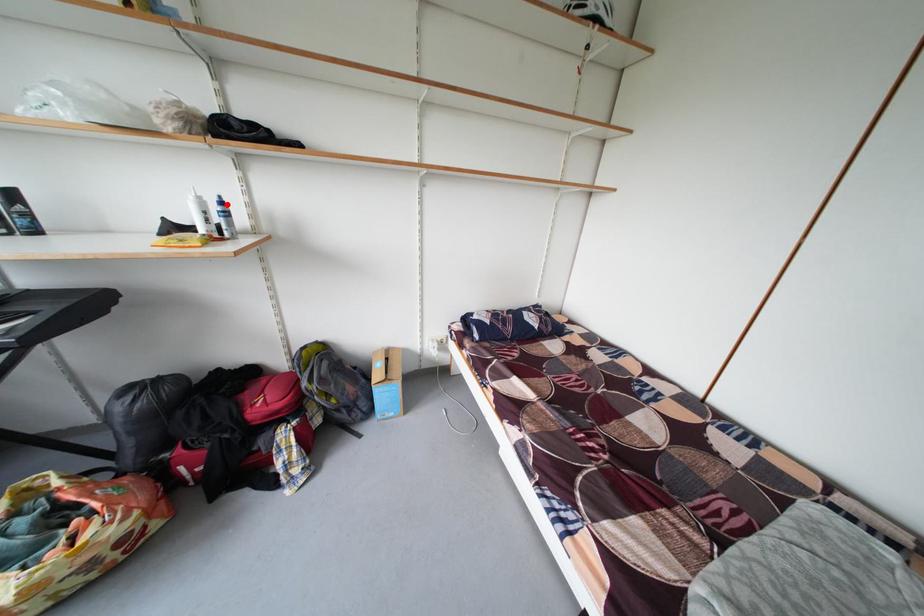
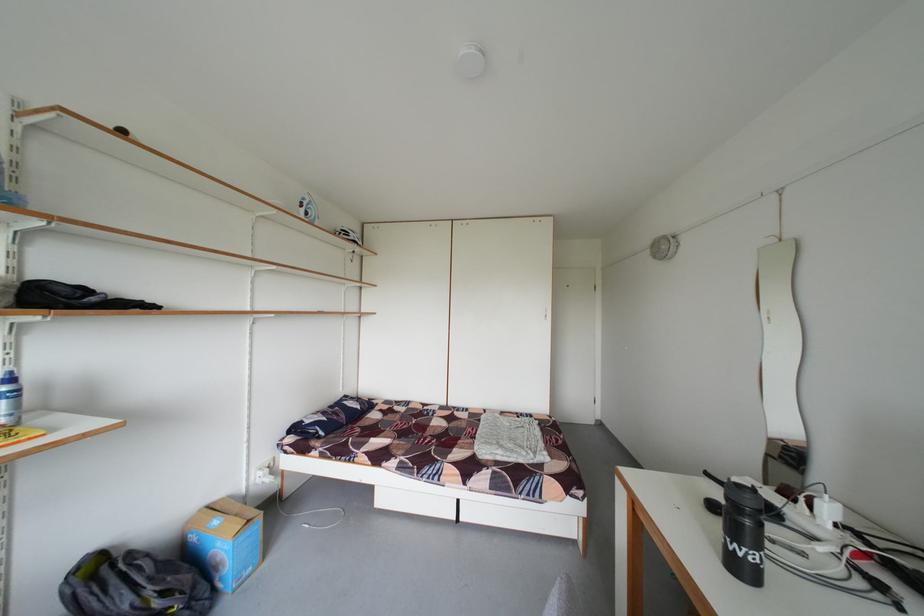
Find the pixel in the second image that matches the highlighted location in the first image.

(10, 383)